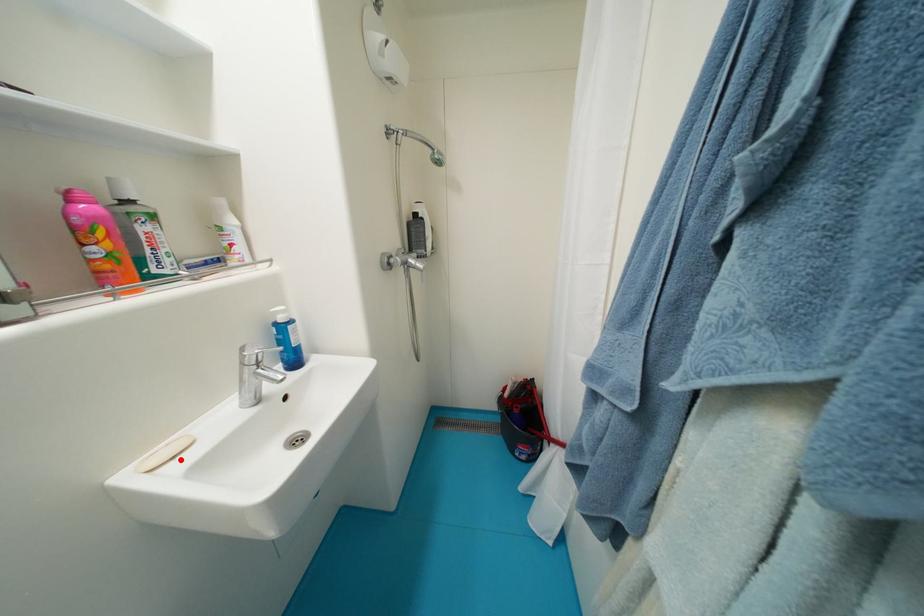
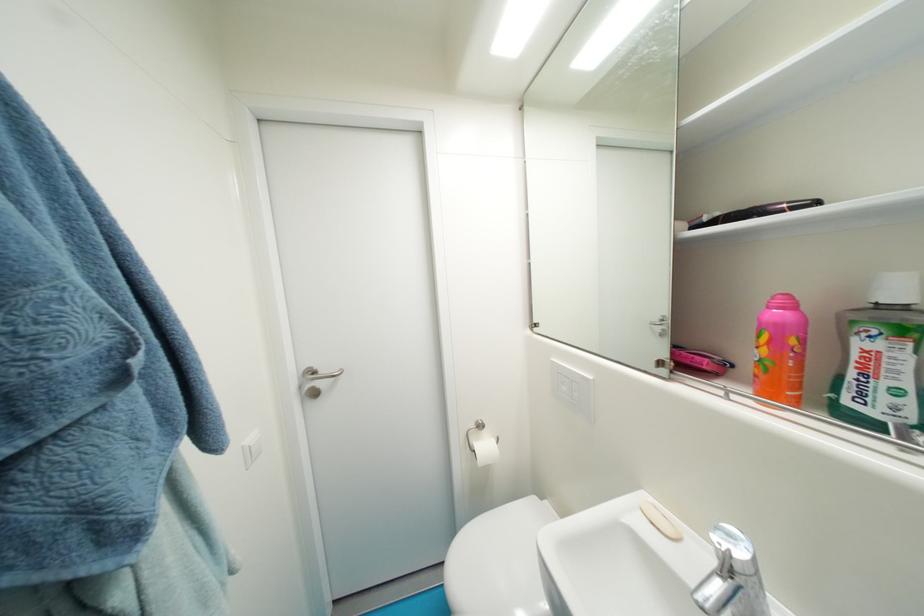
Find the pixel in the second image that matches the highlighted location in the first image.

(659, 525)